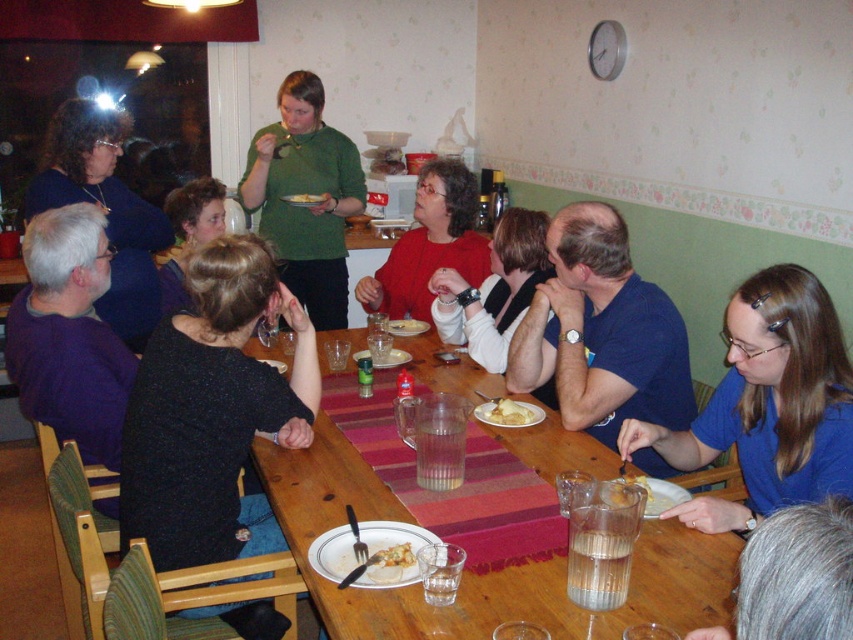
Can you confirm if yellow crumbly food at center is shorter than yellow matte pizza at center?

Correct, yellow crumbly food at center is not as tall as yellow matte pizza at center.

Does point (409, 552) come in front of point (294, 202)?

Yes, point (409, 552) is in front of point (294, 202).

Locate an element on the screen. yellow crumbly food at center is located at coordinates (393, 556).

Between wooden table at center and yellow crumbly food at center, which one appears on the right side from the viewer's perspective?

wooden table at center is more to the right.

Where is `wooden table at center`? The width and height of the screenshot is (853, 640). wooden table at center is located at coordinates (480, 573).

The image size is (853, 640). Identify the location of wooden table at center. (480, 573).

Can you confirm if wooden table at center is smaller than gray hair at lower right?

No.

Can you confirm if wooden table at center is bigger than gray hair at lower right?

Correct, wooden table at center is larger in size than gray hair at lower right.

The image size is (853, 640). I want to click on wooden table at center, so click(480, 573).

Locate an element on the screen. Image resolution: width=853 pixels, height=640 pixels. wooden table at center is located at coordinates (480, 573).